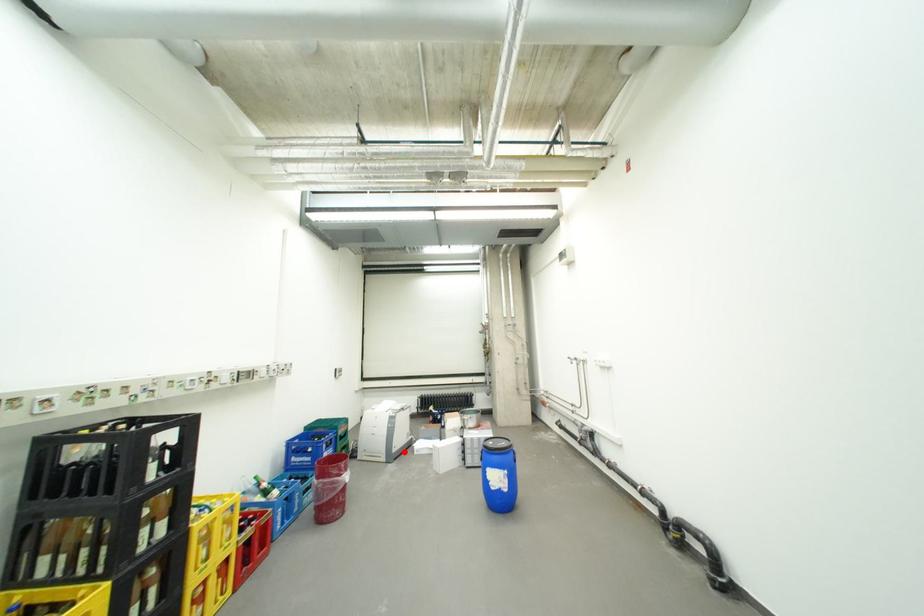
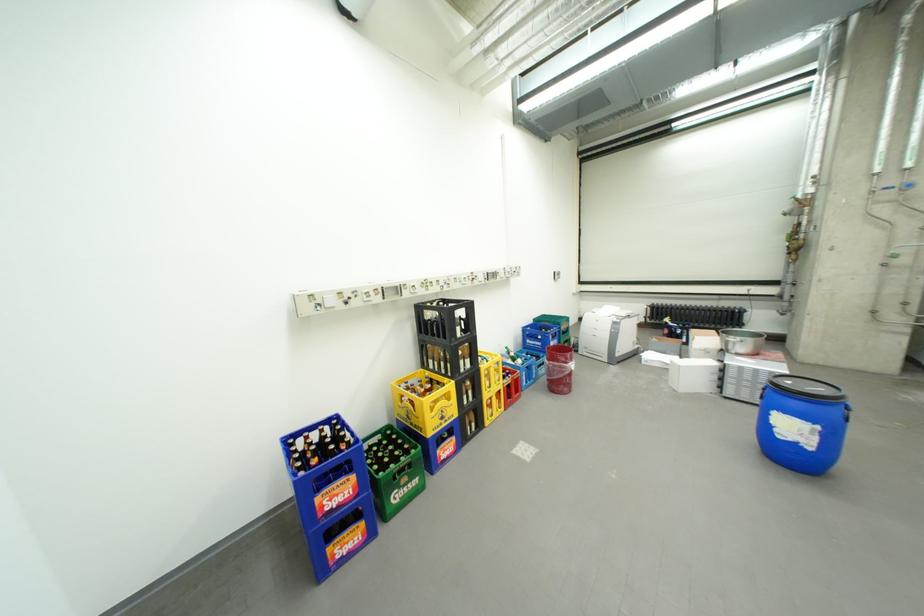
Question: I am providing you with two images of the same scene from different viewpoints. In image1, a red point is highlighted. Considering the same 3D point in image2, which of the following is correct?

Choices:
 (A) It is closer
 (B) It is farther

Answer: (A)